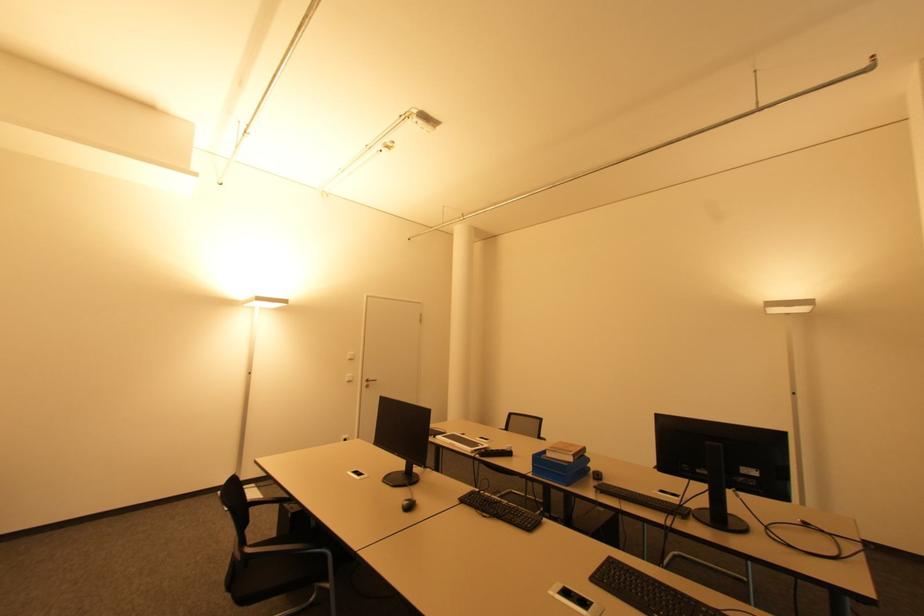
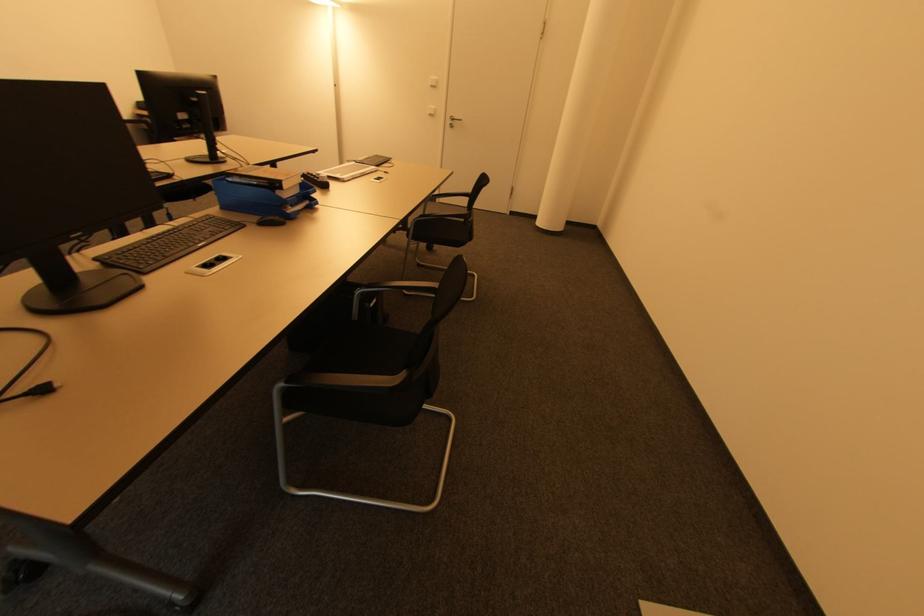
Where in the second image is the point corresponding to [351,360] from the first image?

(434, 87)